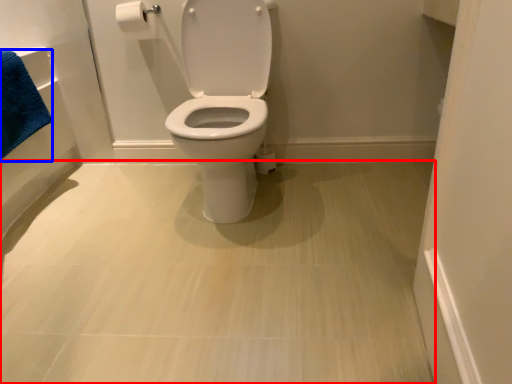
Question: Which point is further to the camera, plain (highlighted by a red box) or bath towel (highlighted by a blue box)?

Choices:
 (A) plain
 (B) bath towel

Answer: (B)